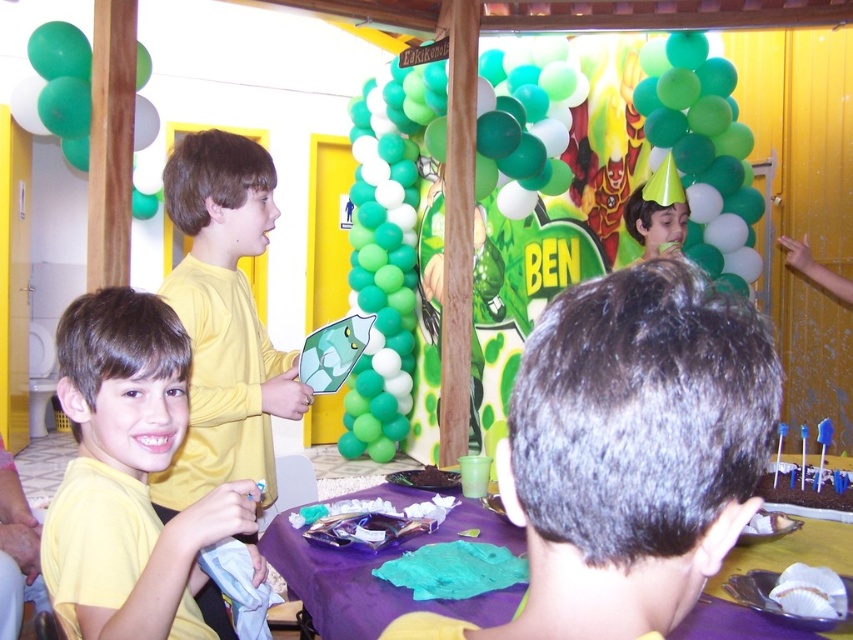
You are a photographer at the party and want to take a picture of both the shiny yellow shirt at center and the green matte balloon at center. Which object should you focus on first to ensure both are in the frame?

You should focus on the shiny yellow shirt at center first since it is in front of the green matte balloon at center, ensuring both are visible in the frame.

You are a photographer at the party and want to take a photo of the shiny yellow shirt at center and the green matte balloon at center. Which object is shorter?

The shiny yellow shirt at center is shorter than the green matte balloon at center.

You are a photographer at the party and want to take a photo of the yellow matte shirt at lower left and the purple fabric table at lower center. Do you need to adjust your camera angle to ensure both are visible in the frame?

The yellow matte shirt at lower left is in front of the purple fabric table at lower center, so you will need to adjust your camera angle to ensure both are visible in the frame.